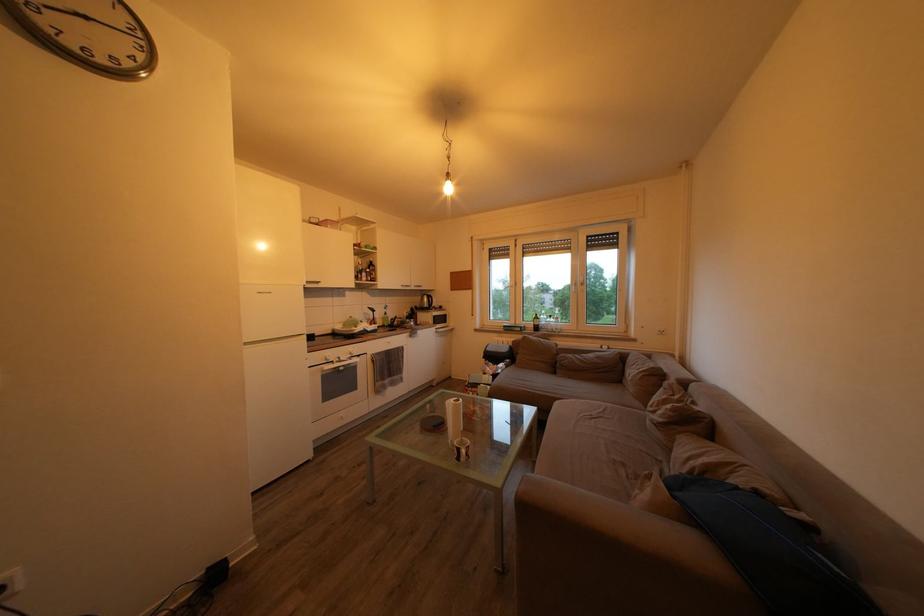
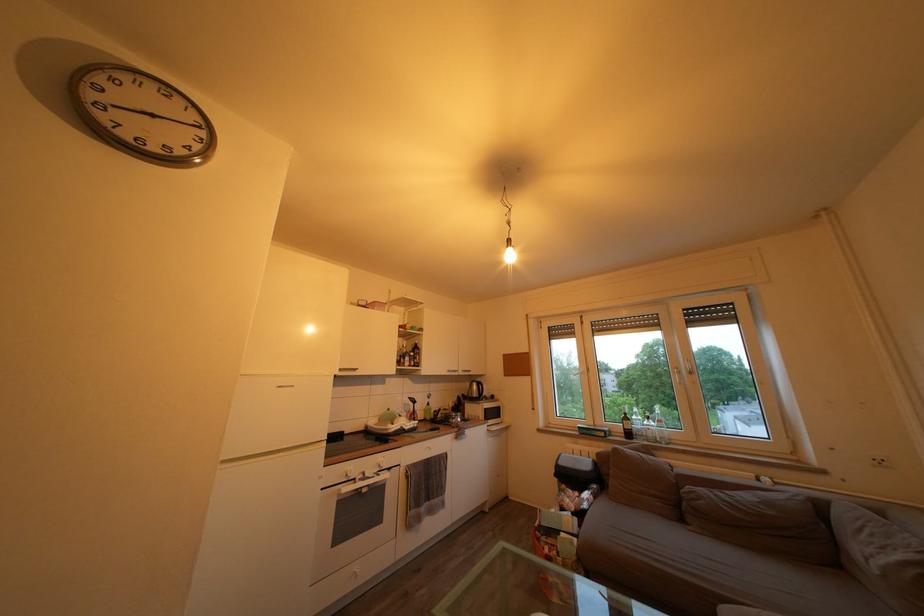
In the second image, find the point that corresponds to the point at 441,336 in the first image.

(492, 434)